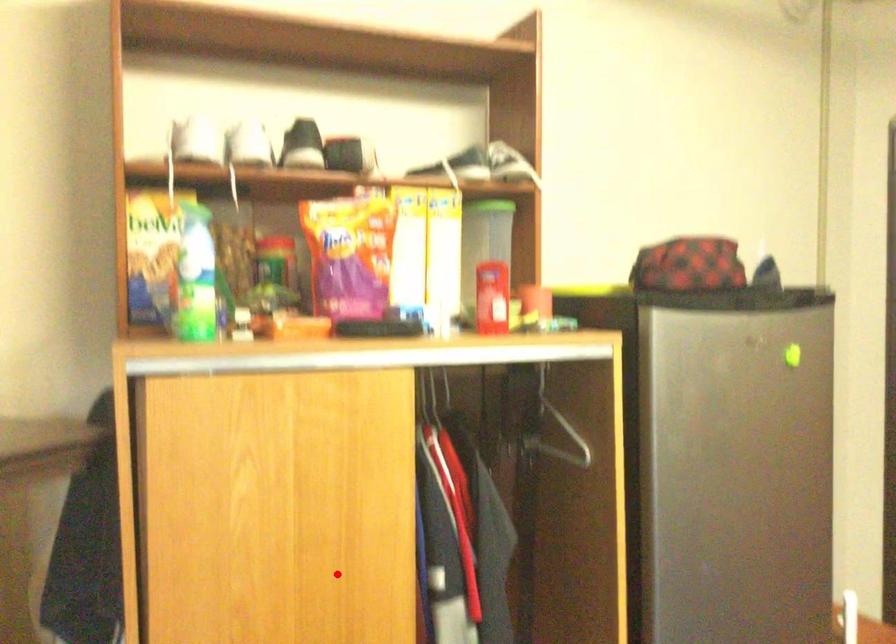
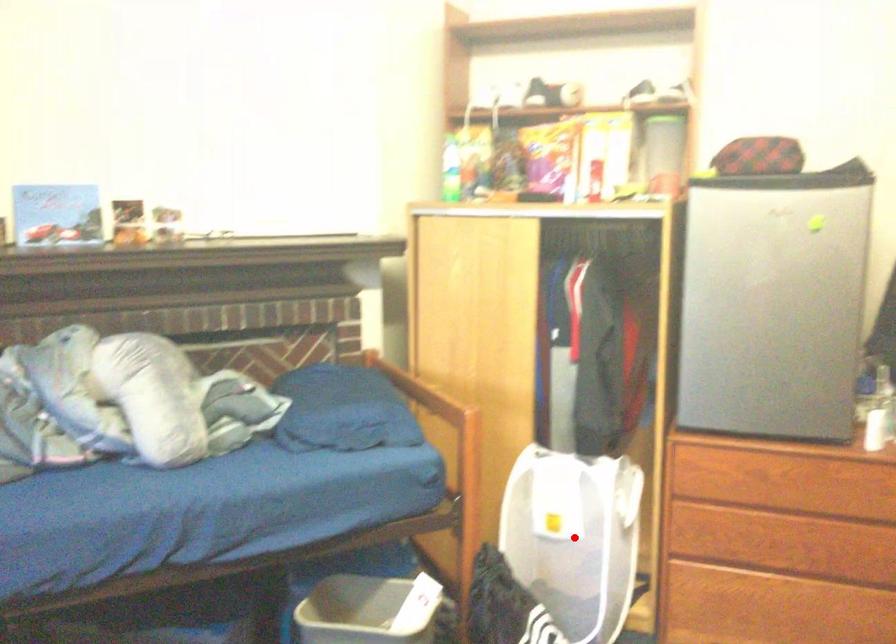
I am providing you with two images of the same scene from different viewpoints. A red point is marked on the first image and another point is marked on the second image. Do the highlighted points in image1 and image2 indicate the same real-world spot?

No